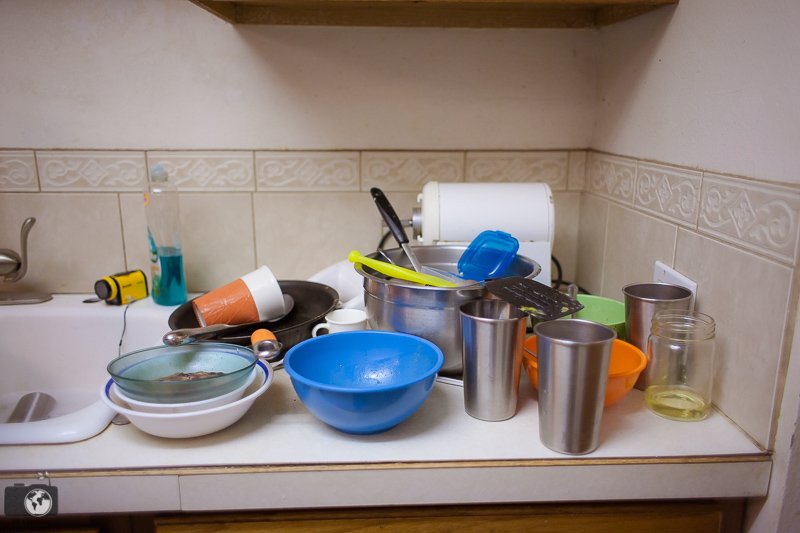
Image resolution: width=800 pixels, height=533 pixels. What are the coordinates of `cups` in the screenshot? It's located at (26, 413), (488, 353), (578, 370), (646, 310), (348, 320), (248, 288).